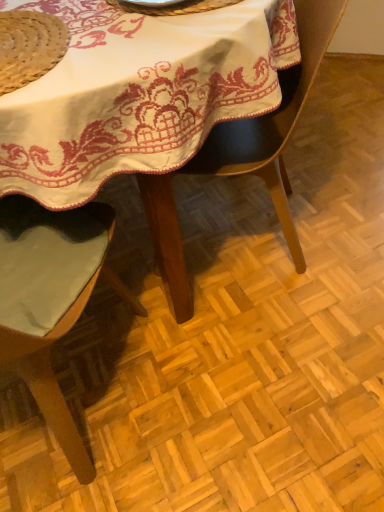
Locate an element on the screen. This screenshot has width=384, height=512. vacant point to the right of green fabric chair at left, which appears as the 1th chair when viewed from the left is located at coordinates (224, 382).